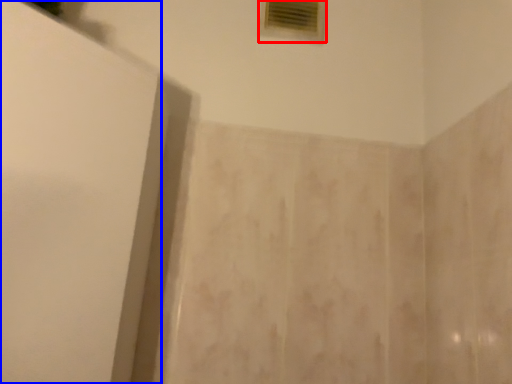
Question: Which object appears closest to the camera in this image, window (highlighted by a red box) or screen door (highlighted by a blue box)?

Choices:
 (A) window
 (B) screen door

Answer: (B)